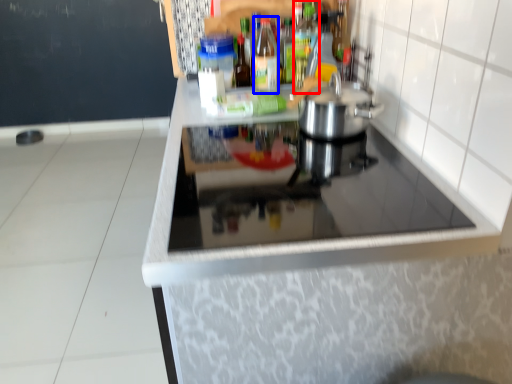
Question: Which object is closer to the camera taking this photo, bottle (highlighted by a red box) or bottle (highlighted by a blue box)?

Choices:
 (A) bottle
 (B) bottle

Answer: (A)